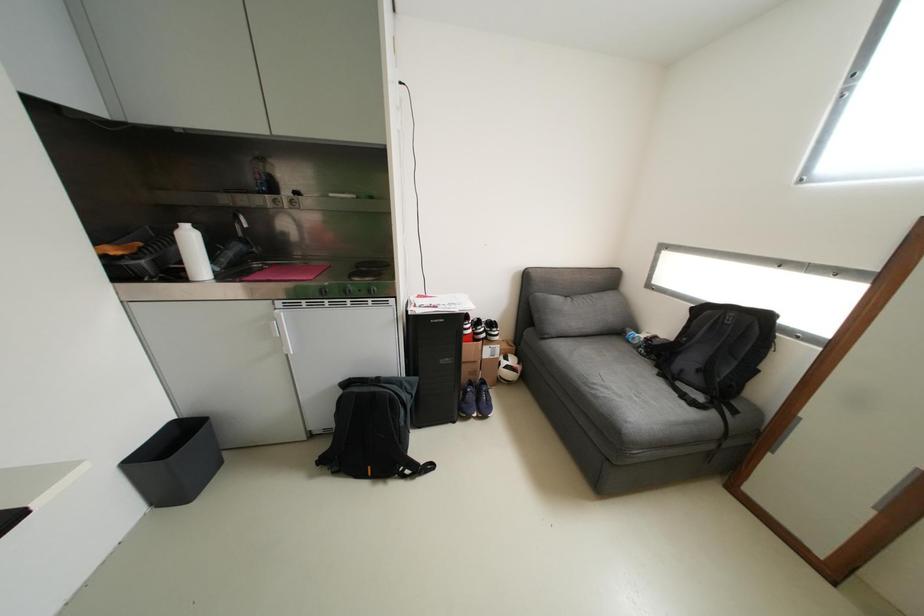
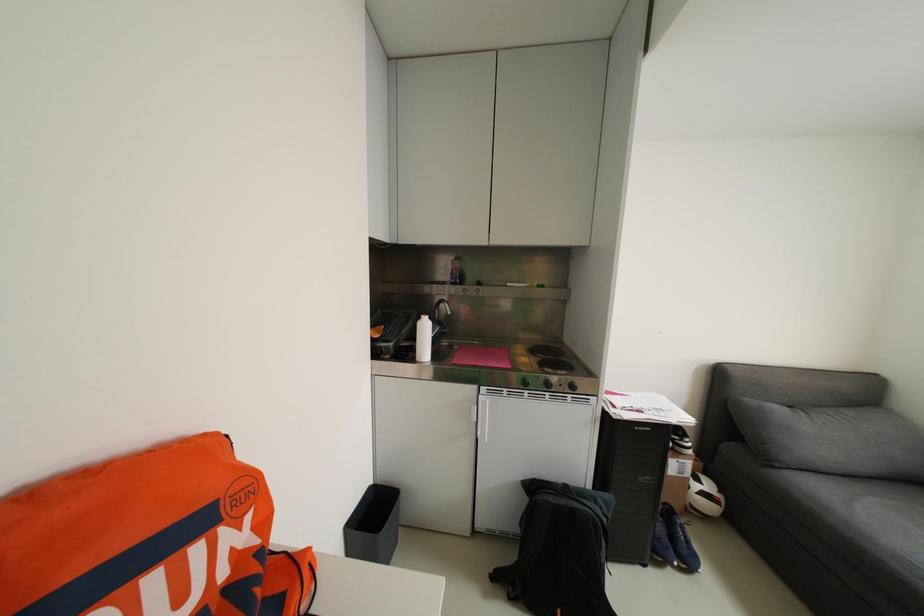
Question: What movement of the cameraman would produce the second image?

Choices:
 (A) Left
 (B) Right
 (C) Forward
 (D) Backward

Answer: (A)